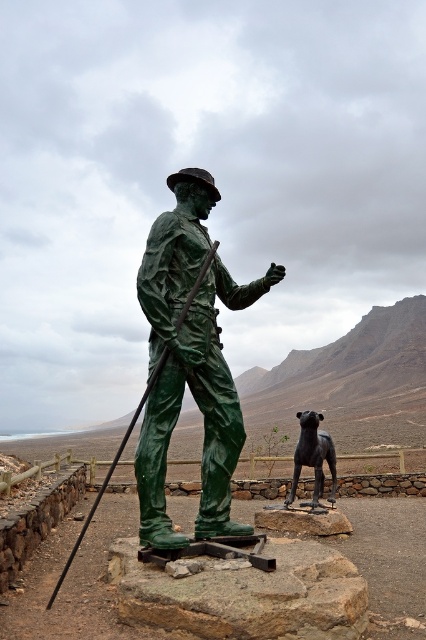
Question: Considering the real-world distances, which object is farthest from the granite rock at center?

Choices:
 (A) shiny black statue at center
 (B) green polished bronze statue at center

Answer: (A)

Question: Which is nearer to the granite rock at center?

Choices:
 (A) green polished bronze statue at center
 (B) shiny black statue at center

Answer: (A)

Question: Among these objects, which one is nearest to the camera?

Choices:
 (A) shiny black statue at center
 (B) granite rock at center
 (C) green polished bronze statue at center

Answer: (B)

Question: Observing the image, what is the correct spatial positioning of green polished bronze statue at center in reference to shiny black statue at center?

Choices:
 (A) below
 (B) above

Answer: (B)

Question: Is green polished bronze statue at center wider than shiny black statue at center?

Choices:
 (A) no
 (B) yes

Answer: (A)

Question: Does green polished bronze statue at center appear under shiny black statue at center?

Choices:
 (A) yes
 (B) no

Answer: (B)